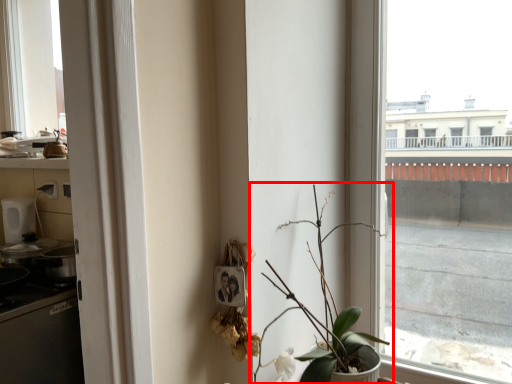
Question: From the image's perspective, considering the relative positions of houseplant (annotated by the red box) and window in the image provided, where is houseplant (annotated by the red box) located with respect to the staircase?

Choices:
 (A) below
 (B) above

Answer: (A)